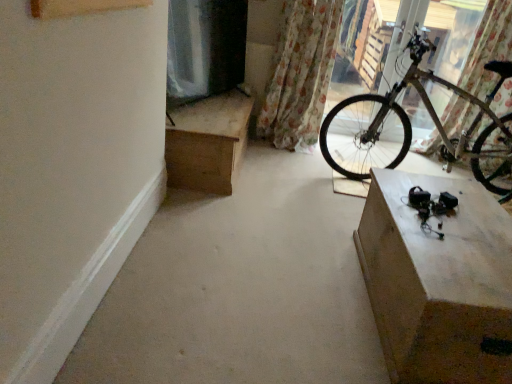
Question: Would you say matte concrete cabinet at lower right is to the left or to the right of floral fabric curtain at upper right, marked as the first curtain in a right-to-left arrangement, in the picture?

Choices:
 (A) right
 (B) left

Answer: (B)

Question: Is point (416, 263) closer or farther from the camera than point (463, 87)?

Choices:
 (A) farther
 (B) closer

Answer: (B)

Question: Considering the real-world distances, which object is farthest from the wooden desk at upper left?

Choices:
 (A) floral fabric curtain at upper right, which ranks as the 2th curtain in right-to-left order
 (B) smooth concrete at center
 (C) matte concrete cabinet at lower right
 (D) floral fabric curtain at upper right, which appears as the 2th curtain when viewed from the left
 (E) metallic silver bicycle at right

Answer: (D)

Question: Estimate the real-world distances between objects in this image. Which object is farther from the white smooth baseboard at lower left?

Choices:
 (A) matte concrete cabinet at lower right
 (B) metallic silver bicycle at right
 (C) wooden desk at upper left
 (D) floral fabric curtain at upper right, marked as the first curtain in a right-to-left arrangement
 (E) floral fabric curtain at upper right, which is the first curtain in left-to-right order

Answer: (D)